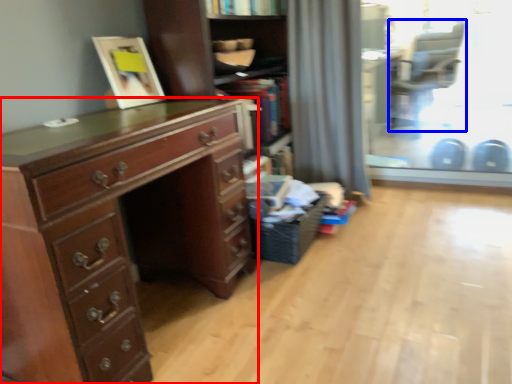
Question: Which object is closer to the camera taking this photo, chest of drawers (highlighted by a red box) or armchair (highlighted by a blue box)?

Choices:
 (A) chest of drawers
 (B) armchair

Answer: (A)